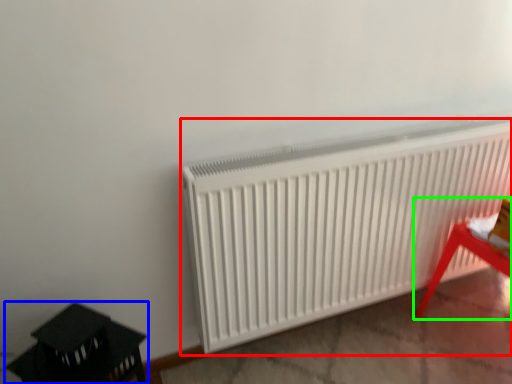
Question: Which object is the closest to the radiator (highlighted by a red box)? Choose among these: furniture (highlighted by a blue box) or furniture (highlighted by a green box).

Choices:
 (A) furniture
 (B) furniture

Answer: (B)